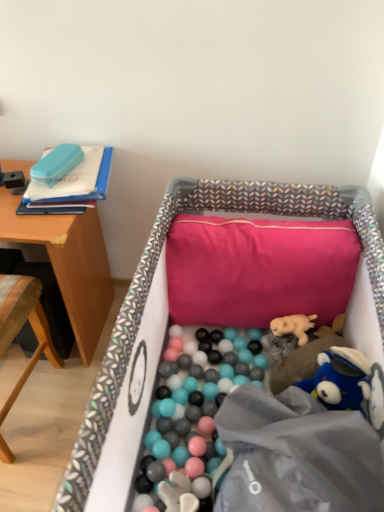
Question: Does fabric-lined crib at center have a lesser height compared to fluffy beige stuffed animal at center-right, which appears as the first toy when viewed from the right?

Choices:
 (A) yes
 (B) no

Answer: (B)

Question: Can you confirm if fabric-lined crib at center is wider than fluffy beige stuffed animal at center-right, positioned as the third toy in top-to-bottom order?

Choices:
 (A) no
 (B) yes

Answer: (B)

Question: Does fabric-lined crib at center have a lesser width compared to fluffy beige stuffed animal at center-right, acting as the 3th toy starting from the left?

Choices:
 (A) yes
 (B) no

Answer: (B)

Question: Would you say fabric-lined crib at center is outside fluffy beige stuffed animal at center-right, positioned as the third toy in top-to-bottom order?

Choices:
 (A) yes
 (B) no

Answer: (A)

Question: Is fabric-lined crib at center oriented away from fluffy beige stuffed animal at center-right, which is counted as the 1th toy, starting from the bottom?

Choices:
 (A) yes
 (B) no

Answer: (A)

Question: Can you confirm if fabric-lined crib at center is smaller than fluffy beige stuffed animal at center-right, which is counted as the 1th toy, starting from the bottom?

Choices:
 (A) no
 (B) yes

Answer: (A)

Question: Can you confirm if fluffy beige plush at center, which is the second toy from left to right, is positioned to the left of pink fabric pillow at center?

Choices:
 (A) no
 (B) yes

Answer: (A)

Question: Can you confirm if fluffy beige plush at center, which is counted as the second toy, starting from the right, is shorter than pink fabric pillow at center?

Choices:
 (A) no
 (B) yes

Answer: (B)

Question: Could you tell me if fluffy beige plush at center, which is counted as the second toy, starting from the right, is facing pink fabric pillow at center?

Choices:
 (A) no
 (B) yes

Answer: (A)

Question: Does fluffy beige plush at center, which is counted as the second toy, starting from the right, have a lesser width compared to pink fabric pillow at center?

Choices:
 (A) no
 (B) yes

Answer: (B)

Question: Is fluffy beige plush at center, which is counted as the second toy, starting from the right, turned away from pink fabric pillow at center?

Choices:
 (A) no
 (B) yes

Answer: (A)

Question: Does fluffy beige plush at center, which is counted as the second toy, starting from the right, have a greater height compared to pink fabric pillow at center?

Choices:
 (A) yes
 (B) no

Answer: (B)

Question: Considering the relative sizes of wooden chair at left and fluffy beige stuffed animal at center-right, acting as the 3th toy starting from the left, in the image provided, is wooden chair at left wider than fluffy beige stuffed animal at center-right, acting as the 3th toy starting from the left,?

Choices:
 (A) no
 (B) yes

Answer: (B)